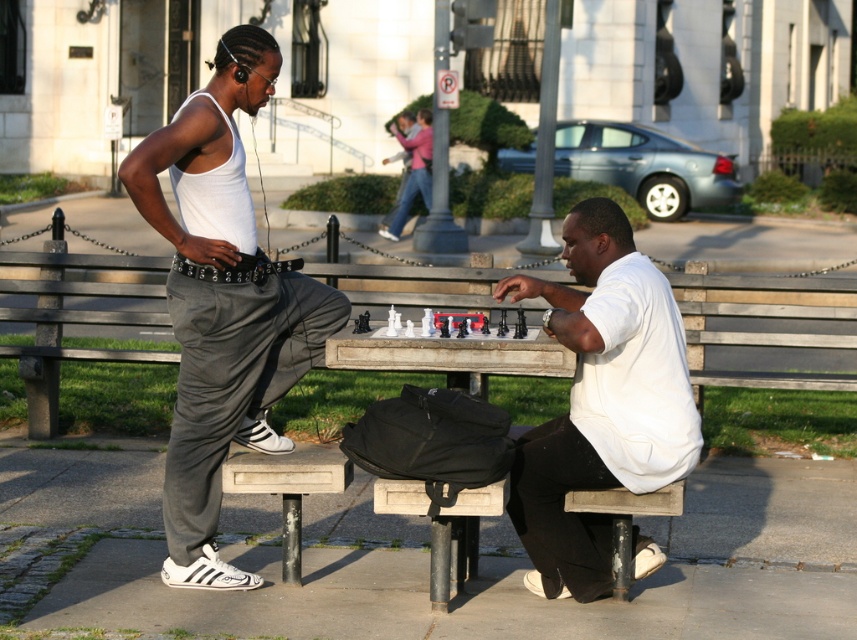
Question: Which of the following is the farthest from the observer?

Choices:
 (A) white matte tank top at left
 (B) pink fabric scarf at upper center

Answer: (B)

Question: Estimate the real-world distances between objects in this image. Which object is farther from the white matte shirt at center?

Choices:
 (A) white glossy chess set at center
 (B) pink fabric scarf at upper center

Answer: (B)

Question: Does pink fabric scarf at upper center appear on the left side of white glossy chess set at center?

Choices:
 (A) yes
 (B) no

Answer: (A)

Question: Is white matte tank top at left smaller than white glossy chess set at center?

Choices:
 (A) yes
 (B) no

Answer: (B)

Question: Is white matte tank top at left further to camera compared to pink fabric scarf at upper center?

Choices:
 (A) no
 (B) yes

Answer: (A)

Question: Estimate the real-world distances between objects in this image. Which object is closer to the white matte tank top at left?

Choices:
 (A) pink fabric scarf at upper center
 (B) white matte shirt at center

Answer: (B)